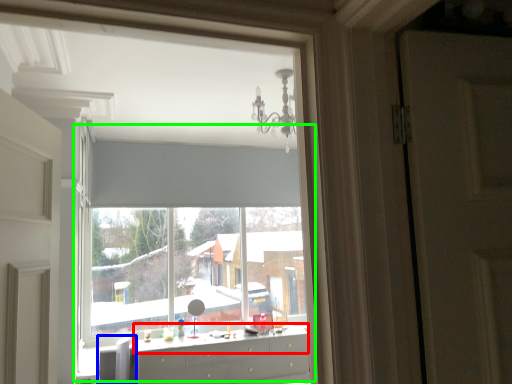
Question: Based on their relative distances, which object is nearer to counter top (highlighted by a red box)? Choose from swivel chair (highlighted by a blue box) and bay window (highlighted by a green box).

Choices:
 (A) swivel chair
 (B) bay window

Answer: (A)